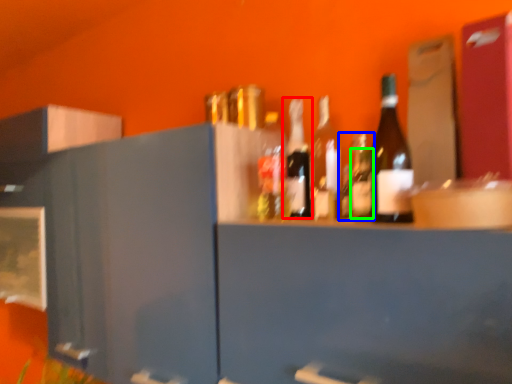
Question: Estimate the real-world distances between objects in this image. Which object is farther from bottle (highlighted by a red box), bottle (highlighted by a blue box) or bottle (highlighted by a green box)?

Choices:
 (A) bottle
 (B) bottle

Answer: (B)